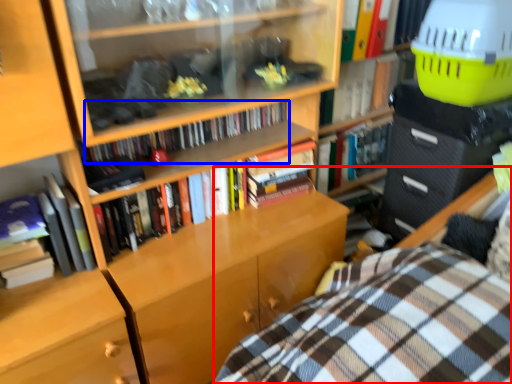
Question: Which of the following is the closest to the observer, bed (highlighted by a red box) or book (highlighted by a blue box)?

Choices:
 (A) bed
 (B) book

Answer: (A)